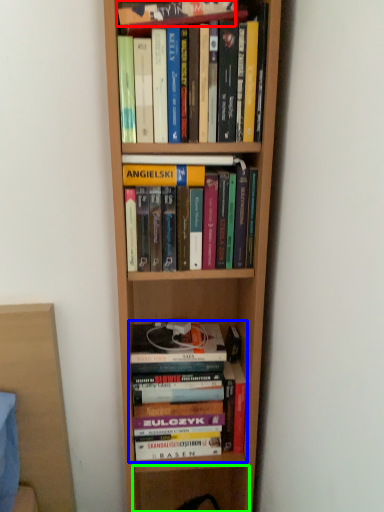
Question: Which is farther away from book (highlighted by a red box)? book (highlighted by a blue box) or shelf (highlighted by a green box)?

Choices:
 (A) book
 (B) shelf

Answer: (B)